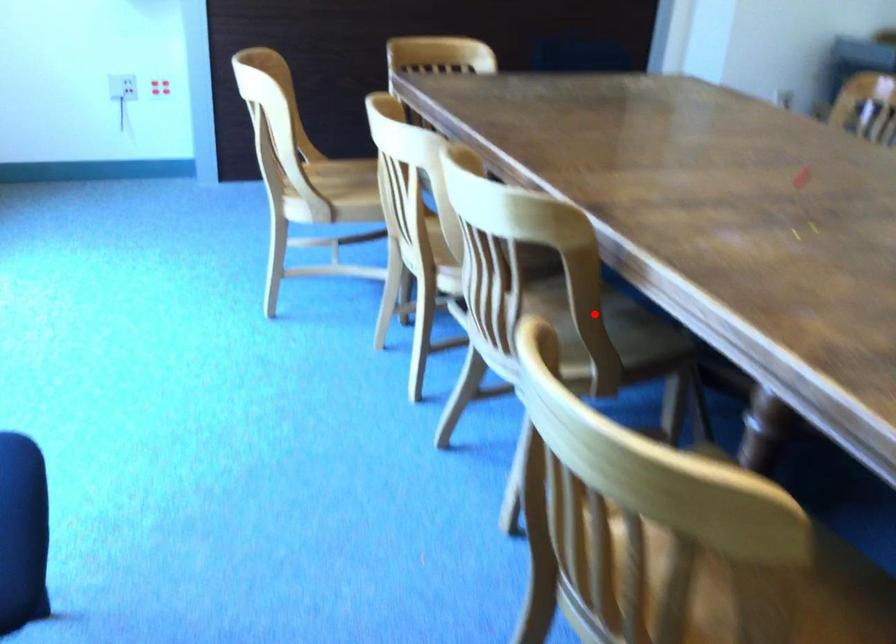
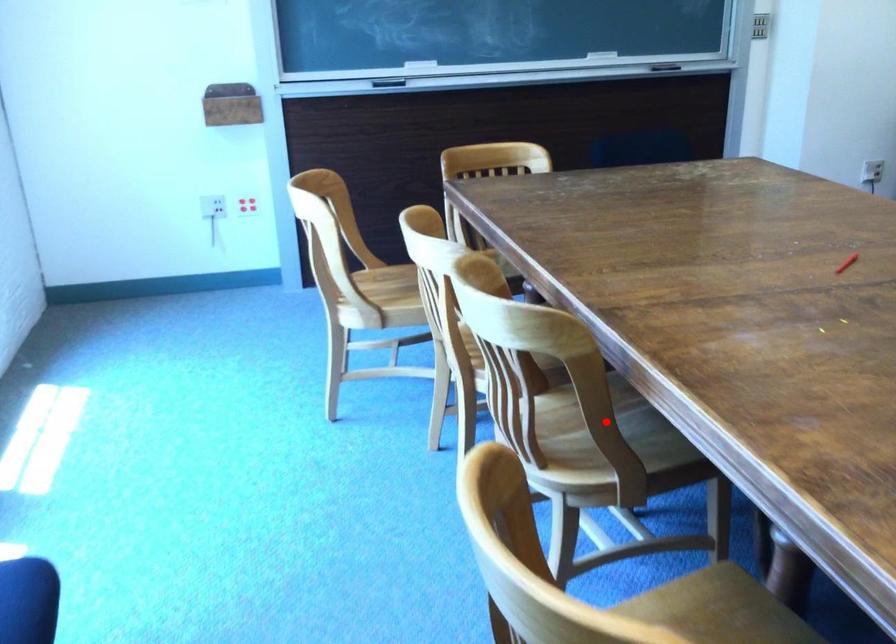
I am providing you with two images of the same scene from different viewpoints. A red point is marked on the first image and another point is marked on the second image. Are the points marked in image1 and image2 representing the same 3D position?

Yes